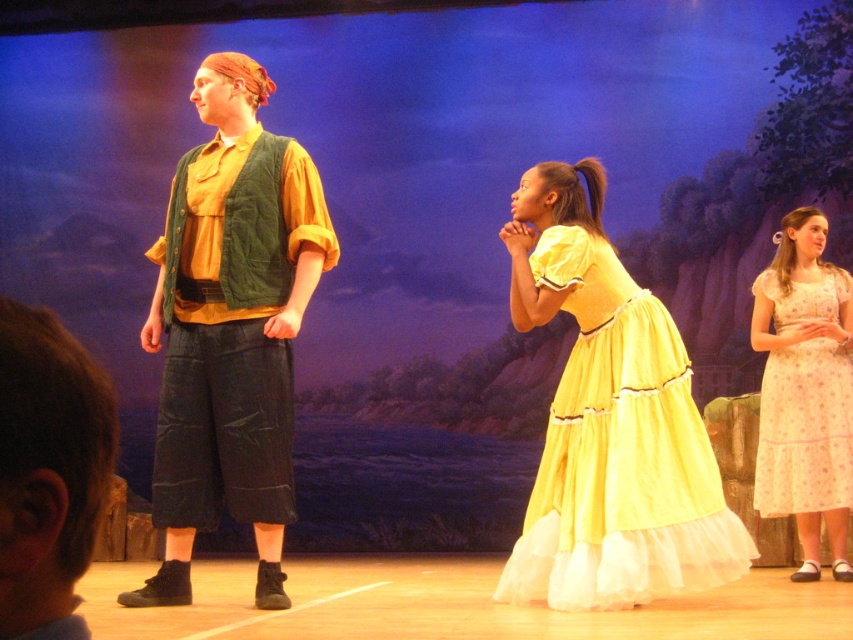
Question: Does matte green vest at left have a greater width compared to light pink polka dot dress at right?

Choices:
 (A) no
 (B) yes

Answer: (B)

Question: Is matte green vest at left further to the viewer compared to light pink polka dot dress at right?

Choices:
 (A) yes
 (B) no

Answer: (B)

Question: Which object is closer to the camera taking this photo?

Choices:
 (A) light pink polka dot dress at right
 (B) matte green vest at left

Answer: (B)

Question: Which of the following is the closest to the observer?

Choices:
 (A) (248, 273)
 (B) (834, 292)
 (C) (593, 301)

Answer: (A)

Question: Is matte green vest at left above light pink polka dot dress at right?

Choices:
 (A) no
 (B) yes

Answer: (B)

Question: Which of the following is the farthest from the observer?

Choices:
 (A) (280, 241)
 (B) (776, 385)

Answer: (B)